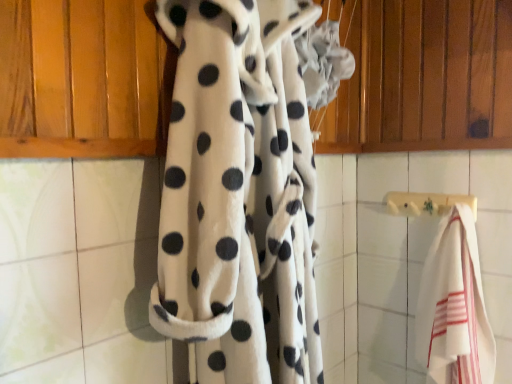
Image resolution: width=512 pixels, height=384 pixels. What do you see at coordinates (426, 203) in the screenshot?
I see `wooden towel bar at center` at bounding box center [426, 203].

Identify the location of white striped towel at right. This screenshot has height=384, width=512. (454, 306).

Can you tell me how much wooden towel bar at center and white fleece blanket at center differ in facing direction?

They differ by 90.7 degrees in their facing directions.

Is wooden towel bar at center thinner than white fleece blanket at center?

Correct, the width of wooden towel bar at center is less than that of white fleece blanket at center.

From their relative heights in the image, would you say wooden towel bar at center is taller or shorter than white fleece blanket at center?

In the image, wooden towel bar at center appears to be shorter than white fleece blanket at center.

Who is more distant, wooden towel bar at center or white fleece blanket at center?

Positioned behind is wooden towel bar at center.

Is point (272, 44) closer to camera compared to point (466, 315)?

That is True.

Locate an element on the screen. Image resolution: width=512 pixels, height=384 pixels. curtain on the left of white striped towel at right is located at coordinates click(x=244, y=187).

Considering the sizes of objects white fleece blanket at center and white striped towel at right in the image provided, who is bigger, white fleece blanket at center or white striped towel at right?

white fleece blanket at center is bigger.

Is point (262, 17) behind point (417, 205)?

No, it is in front of (417, 205).

Which object is closer to the camera taking this photo, white fleece blanket at center or wooden towel bar at center?

white fleece blanket at center is more forward.

Is white fleece blanket at center to the left of wooden towel bar at center from the viewer's perspective?

Yes, white fleece blanket at center is to the left of wooden towel bar at center.

Is wooden towel bar at center at the back of white fleece blanket at center?

No, wooden towel bar at center is not at the back of white fleece blanket at center.

Between wooden towel bar at center and white striped towel at right, which one has more height?

Standing taller between the two is white striped towel at right.

Which is in front, point (447, 210) or point (441, 294)?

Positioned in front is point (441, 294).

Based on their positions, is wooden towel bar at center located to the left or right of white striped towel at right?

Based on their positions, wooden towel bar at center is located to the left of white striped towel at right.

Identify the location of towel below the wooden towel bar at center (from a real-world perspective). This screenshot has width=512, height=384. (454, 306).

Which object is further away from the camera taking this photo, white striped towel at right or wooden towel bar at center?

wooden towel bar at center is further away from the camera.

Which object is wider, white striped towel at right or wooden towel bar at center?

white striped towel at right.

Considering the positions of objects white striped towel at right and wooden towel bar at center in the image provided, who is more to the left, white striped towel at right or wooden towel bar at center?

wooden towel bar at center is more to the left.

Based on their positions, is white striped towel at right located to the left or right of white fleece blanket at center?

white striped towel at right is to the right of white fleece blanket at center.

From a real-world perspective, is white striped towel at right positioned above or below white fleece blanket at center?

In terms of real-world spatial position, white striped towel at right is below white fleece blanket at center.

Which of these two, white striped towel at right or white fleece blanket at center, stands shorter?

With less height is white striped towel at right.

Considering the positions of objects white striped towel at right and white fleece blanket at center in the image provided, who is behind, white striped towel at right or white fleece blanket at center?

white striped towel at right is further from the camera.

The width and height of the screenshot is (512, 384). In order to click on towel bar that appears below the white fleece blanket at center (from a real-world perspective) in this screenshot , I will do `click(426, 203)`.

You are a GUI agent. You are given a task and a screenshot of the screen. Output one action in this format:
    pyautogui.click(x=<x>, y=<y>)
    Task: Click on the towel that appears below the white fleece blanket at center (from the image's perspective)
    The height and width of the screenshot is (384, 512).
    Given the screenshot: What is the action you would take?
    pyautogui.click(x=454, y=306)

From the image, which object appears to be nearer to white fleece blanket at center, wooden towel bar at center or white striped towel at right?

white striped towel at right lies closer to white fleece blanket at center than the other object.

Based on their spatial positions, is white striped towel at right or white fleece blanket at center closer to wooden towel bar at center?

Among the two, white striped towel at right is located nearer to wooden towel bar at center.

Which object lies further to the anchor point white striped towel at right, wooden towel bar at center or white fleece blanket at center?

Based on the image, white fleece blanket at center appears to be further to white striped towel at right.

Based on the photo, which object lies further to the anchor point wooden towel bar at center, white fleece blanket at center or white striped towel at right?

white fleece blanket at center.

Based on the photo, based on their spatial positions, is white striped towel at right or wooden towel bar at center further from white fleece blanket at center?

wooden towel bar at center lies further to white fleece blanket at center than the other object.

From the image, which object appears to be nearer to white striped towel at right, white fleece blanket at center or wooden towel bar at center?

wooden towel bar at center.

Identify the location of towel bar between white fleece blanket at center and white striped towel at right. The height and width of the screenshot is (384, 512). (426, 203).